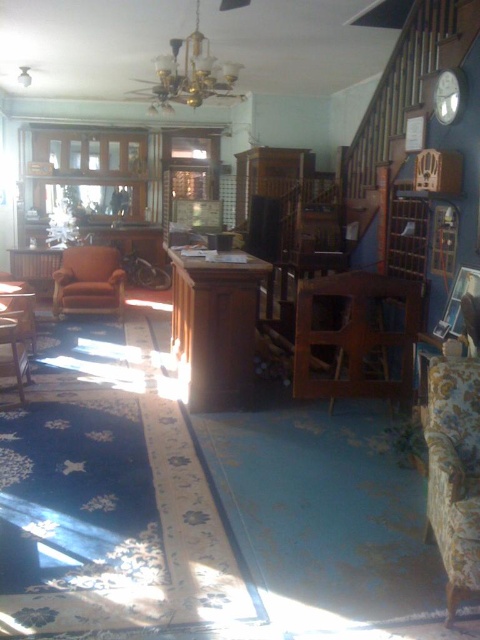
You are standing in the room and notice the metallic gold chandelier at upper center and the leather armchair at center. Which object is closer to the ceiling?

The metallic gold chandelier at upper center is closer to the ceiling because it is positioned higher than the leather armchair at center.

You are standing in the vintage room and want to move from the entrance to the desk. You see the floral fabric armchair at lower right and the leather armchair at center. Which armchair do you need to move past first?

The floral fabric armchair at lower right is in front of the leather armchair at center, so you would need to move past the floral fabric armchair at lower right first.